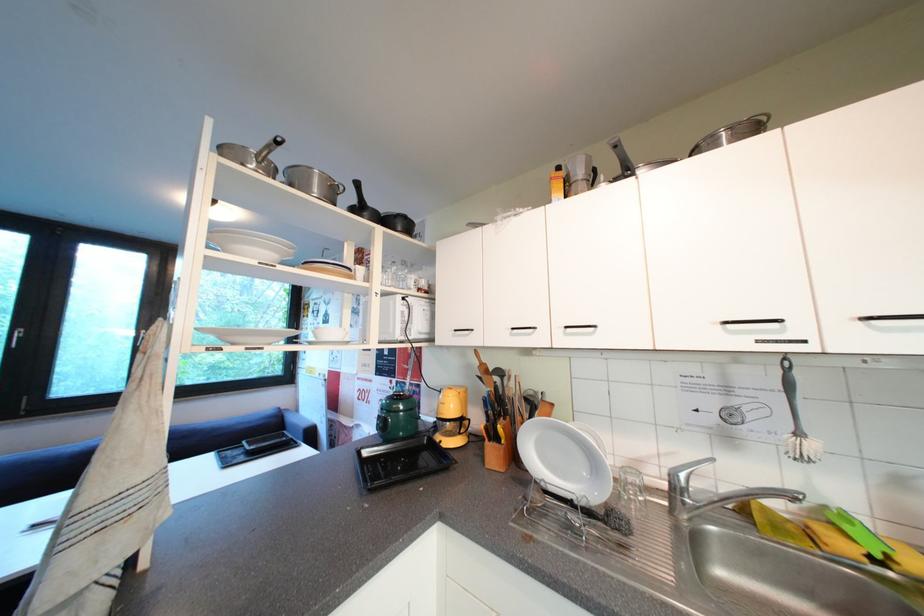
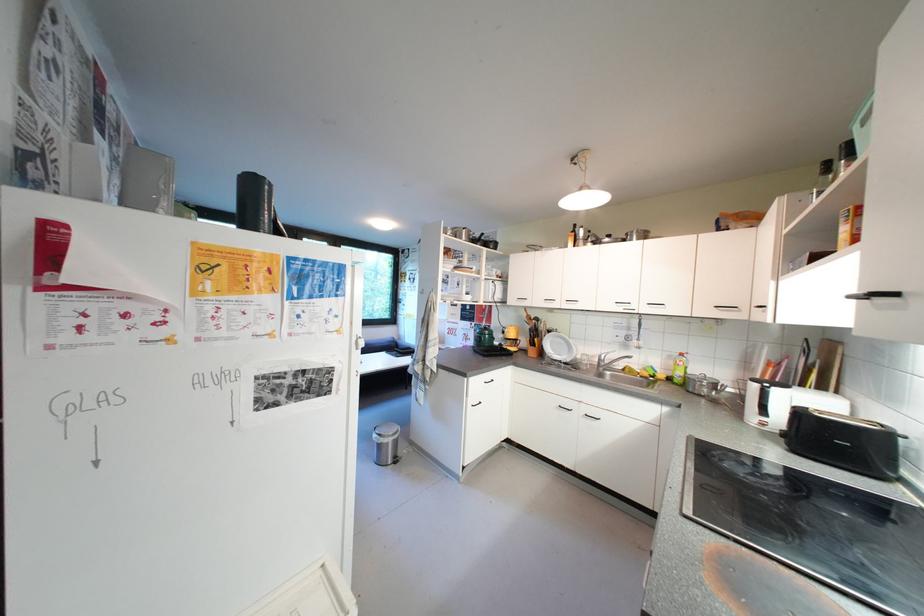
Question: In a continuous first-person perspective shot, in which direction is the camera moving?

Choices:
 (A) Left
 (B) Right
 (C) Forward
 (D) Backward

Answer: (D)